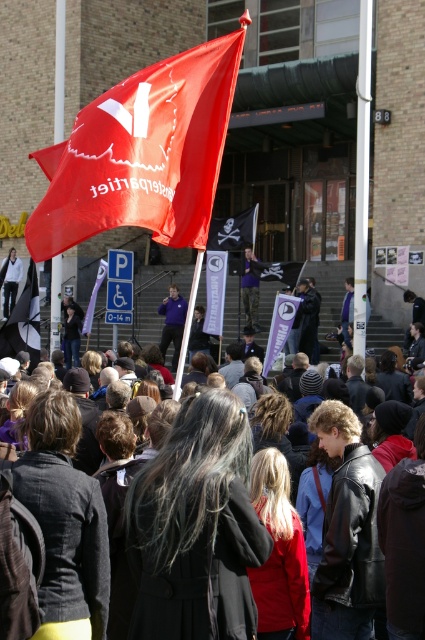
Who is higher up, black fabric flag at center or black pirate flag at center?

black fabric flag at center is higher up.

Which is in front, point (246, 234) or point (294, 284)?

Point (294, 284)

The image size is (425, 640). What are the coordinates of `black fabric flag at center` in the screenshot? It's located at (232, 230).

Does black fabric flag at center appear under purple fabric at center?

Incorrect, black fabric flag at center is not positioned below purple fabric at center.

Does black fabric flag at center have a lesser height compared to purple fabric at center?

Yes, black fabric flag at center is shorter than purple fabric at center.

Is point (232, 243) less distant than point (178, 332)?

Yes, point (232, 243) is closer to viewer.

Image resolution: width=425 pixels, height=640 pixels. I want to click on black fabric flag at center, so click(x=232, y=230).

Which of these two, dark gray coat at center or black pirate flag at center, stands taller?

dark gray coat at center

The height and width of the screenshot is (640, 425). Describe the element at coordinates (353, 512) in the screenshot. I see `dark gray coat at center` at that location.

The height and width of the screenshot is (640, 425). In order to click on dark gray coat at center in this screenshot , I will do `click(353, 512)`.

The image size is (425, 640). I want to click on dark gray coat at center, so click(353, 512).